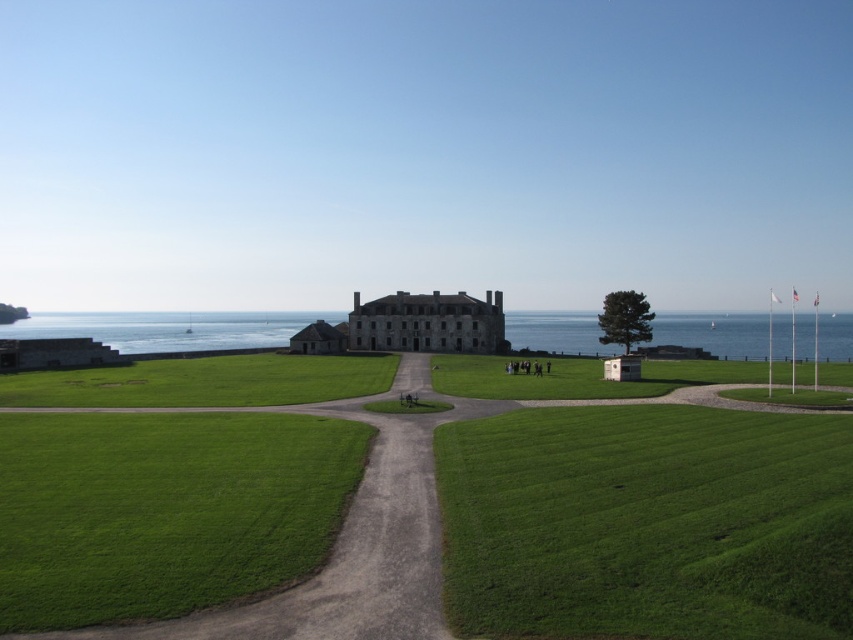
Question: Observing the image, what is the correct spatial positioning of green grass at center in reference to blue water at lower left?

Choices:
 (A) below
 (B) above

Answer: (A)

Question: Does green grass at center have a larger size compared to blue water at lower left?

Choices:
 (A) no
 (B) yes

Answer: (A)

Question: Which point is closer to the camera?

Choices:
 (A) blue water at lower left
 (B) green grass at center

Answer: (B)

Question: Does green grass at center appear under blue water at lower left?

Choices:
 (A) yes
 (B) no

Answer: (A)

Question: Which object appears farthest from the camera in this image?

Choices:
 (A) green grass at center
 (B) blue water at lower left

Answer: (B)